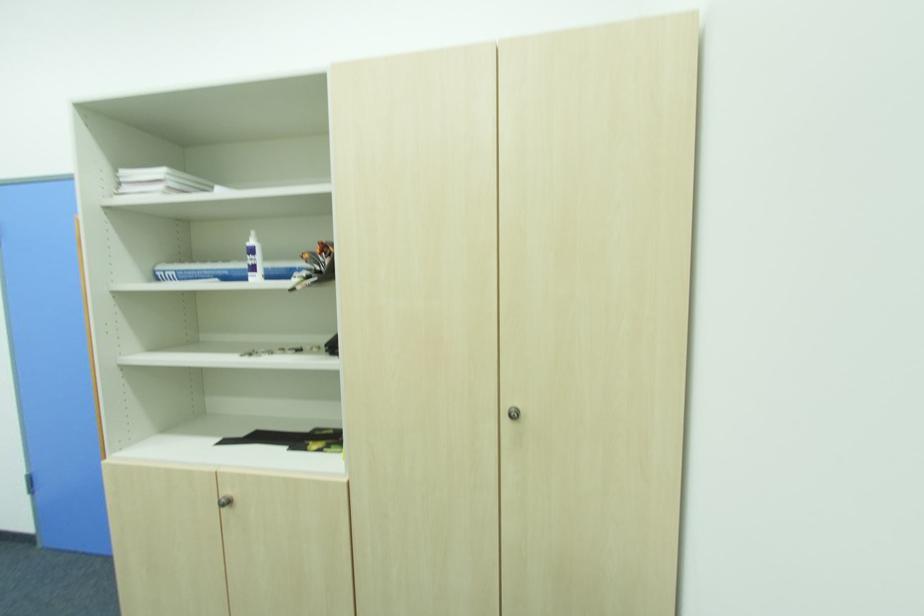
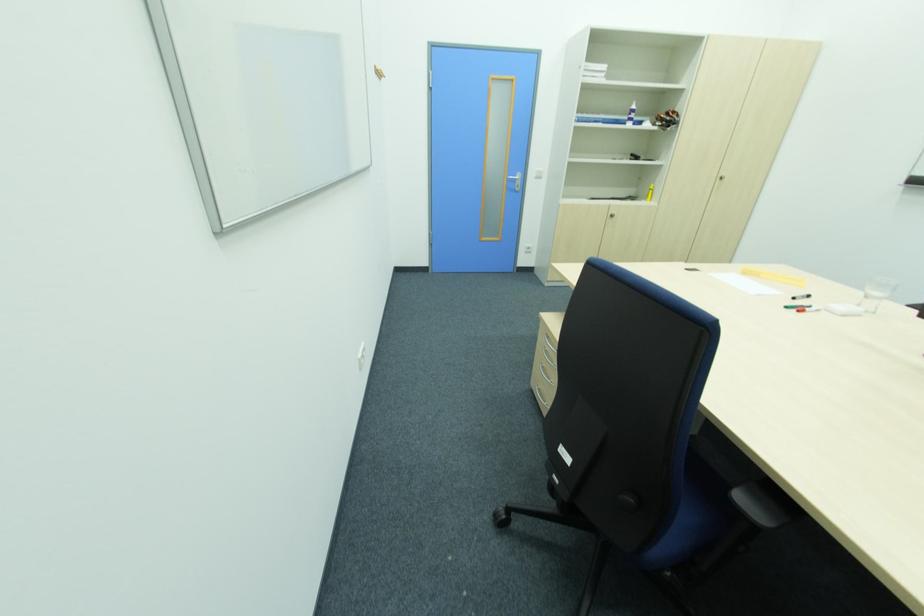
In a continuous first-person perspective shot, in which direction is the camera moving?

The movement direction of the cameraman is left, backward.